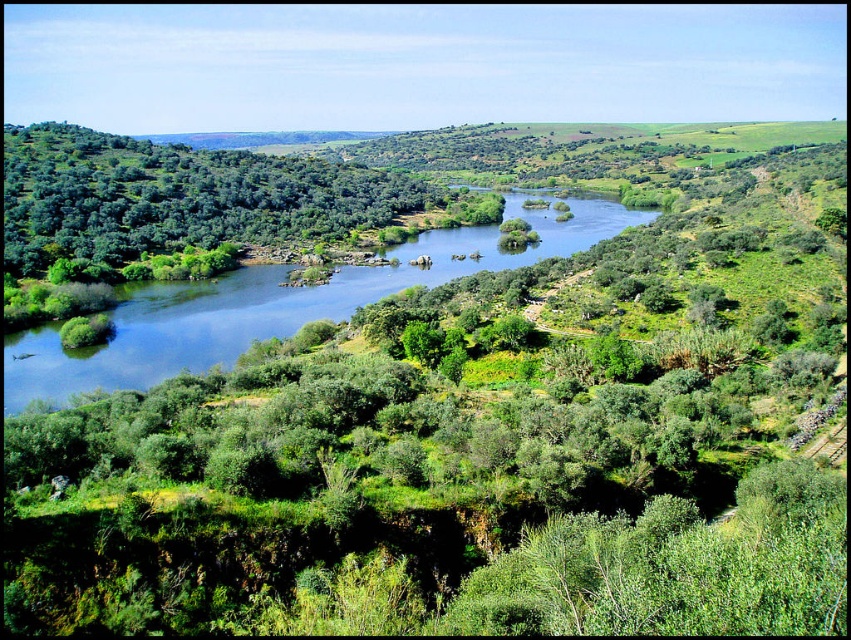
Question: Which of the following is the farthest from the observer?

Choices:
 (A) green leafy trees at left
 (B) blue water at center

Answer: (A)

Question: Can you confirm if green leafy trees at left is positioned below blue water at center?

Choices:
 (A) yes
 (B) no

Answer: (B)

Question: Is green leafy trees at left wider than blue water at center?

Choices:
 (A) no
 (B) yes

Answer: (B)

Question: Can you confirm if green leafy trees at left is positioned below blue water at center?

Choices:
 (A) no
 (B) yes

Answer: (A)